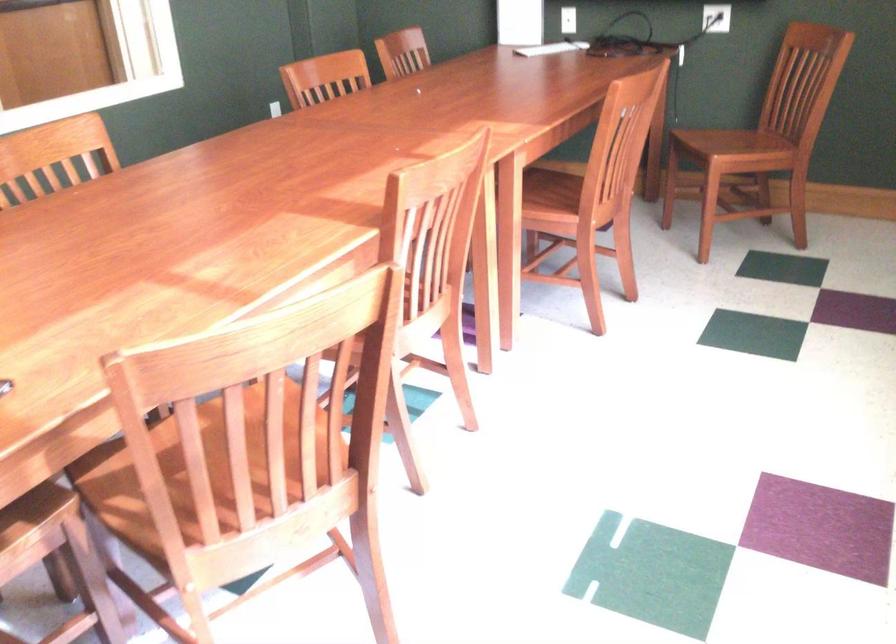
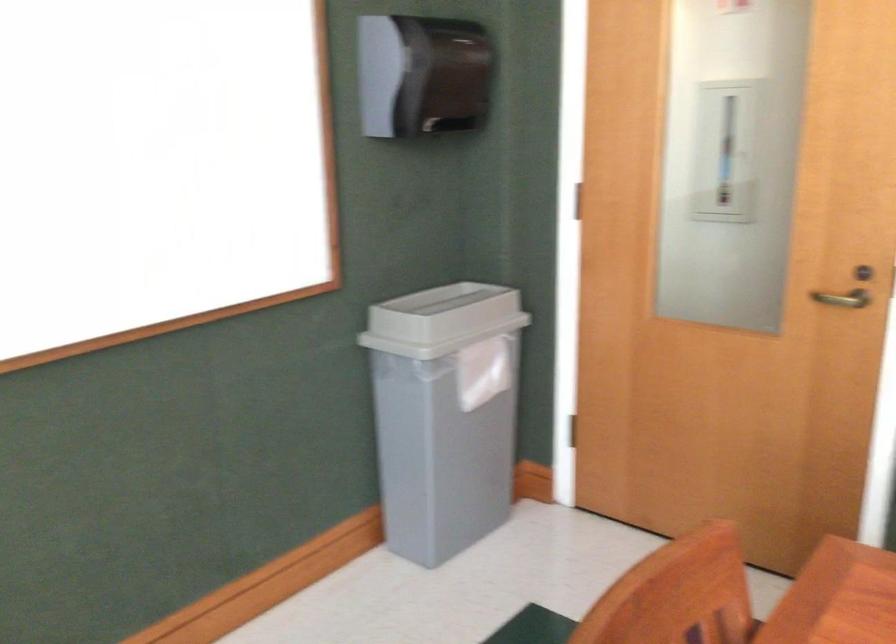
First-person continuous shooting, in which direction is the camera rotating?

The camera's rotation is toward left-down.